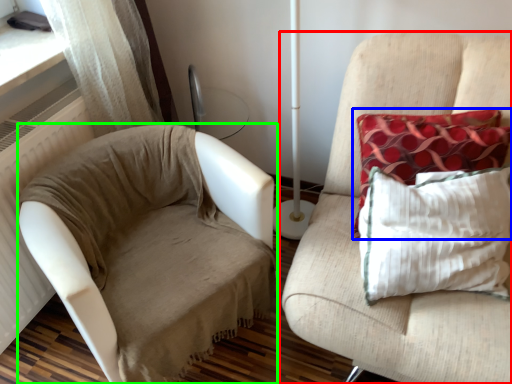
Question: Based on their relative distances, which object is farther from furniture (highlighted by a red box)? Choose from pillow (highlighted by a blue box) and studio couch (highlighted by a green box).

Choices:
 (A) pillow
 (B) studio couch

Answer: (B)